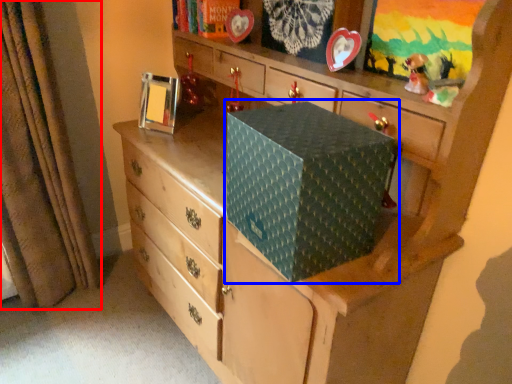
Question: Among these objects, which one is nearest to the camera, curtain (highlighted by a red box) or cardboard box (highlighted by a blue box)?

Choices:
 (A) curtain
 (B) cardboard box

Answer: (B)